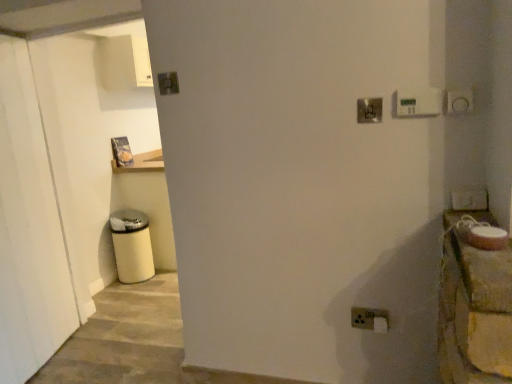
Question: In terms of width, does white plastic electric outlet at lower right look wider or thinner when compared to metallic silver switch at upper right, which ranks as the 2th light switch in left-to-right order?

Choices:
 (A) wide
 (B) thin

Answer: (A)

Question: Considering the relative positions of white plastic electric outlet at lower right and metallic silver switch at upper right, marked as the second light switch in a bottom-to-top arrangement, in the image provided, is white plastic electric outlet at lower right to the left or to the right of metallic silver switch at upper right, marked as the second light switch in a bottom-to-top arrangement,?

Choices:
 (A) left
 (B) right

Answer: (B)

Question: Based on their relative distances, which object is nearer to the white plastic electric outlet at lower right?

Choices:
 (A) white plastic light switch at upper right, acting as the fourth light switch starting from the left
 (B) rustic wood countertop at right
 (C) white plastic thermostat at upper right, the 4th light switch in the back-to-front sequence
 (D) metallic silver switch at upper right, which ranks as the 3th light switch in top-to-bottom order
 (E) metallic square at upper center, the 1th light switch when ordered from left to right

Answer: (A)

Question: Estimate the real-world distances between objects in this image. Which object is farther from the metallic silver switch at upper right, placed as the third light switch when sorted from right to left?

Choices:
 (A) white plastic light switch at upper right, the 4th light switch viewed from the top
 (B) white plastic thermostat at upper right, the second light switch when ordered from top to bottom
 (C) metallic square at upper center, the fourth light switch in the right-to-left sequence
 (D) rustic wood countertop at right
 (E) white plastic electric outlet at lower right

Answer: (E)